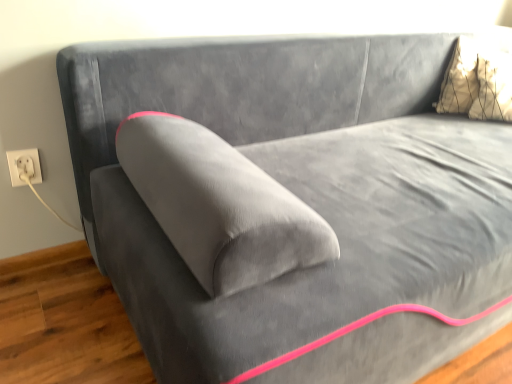
Question: In the image, is metallic gold pillow at upper right on the left side or the right side of white cord at lower left?

Choices:
 (A) left
 (B) right

Answer: (B)

Question: From a real-world perspective, is metallic gold pillow at upper right positioned above or below white cord at lower left?

Choices:
 (A) above
 (B) below

Answer: (A)

Question: Based on their relative distances, which object is farther from the metallic gold pillow at upper right?

Choices:
 (A) white cord at lower left
 (B) white plastic socket at lower left

Answer: (B)

Question: Based on their relative distances, which object is farther from the metallic gold pillow at upper right?

Choices:
 (A) white cord at lower left
 (B) white plastic socket at lower left

Answer: (B)